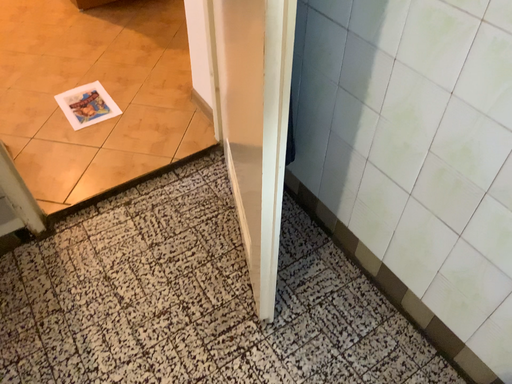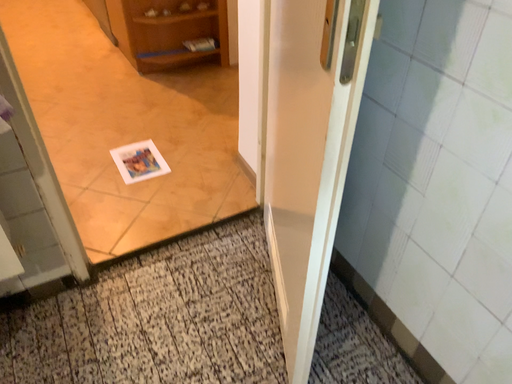
Question: How did the camera likely rotate when shooting the video?

Choices:
 (A) rotated upward
 (B) rotated downward

Answer: (A)